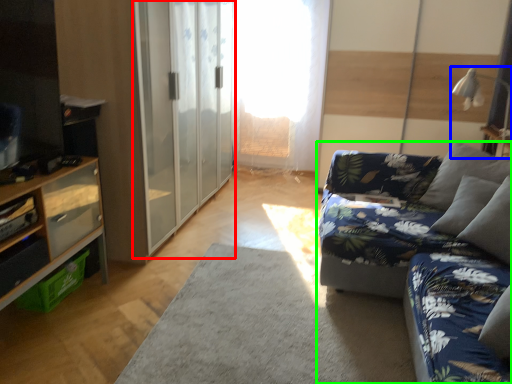
Question: Based on their relative distances, which object is farther from barn door (highlighted by a red box)? Choose from lamp (highlighted by a blue box) and studio couch (highlighted by a green box).

Choices:
 (A) lamp
 (B) studio couch

Answer: (A)